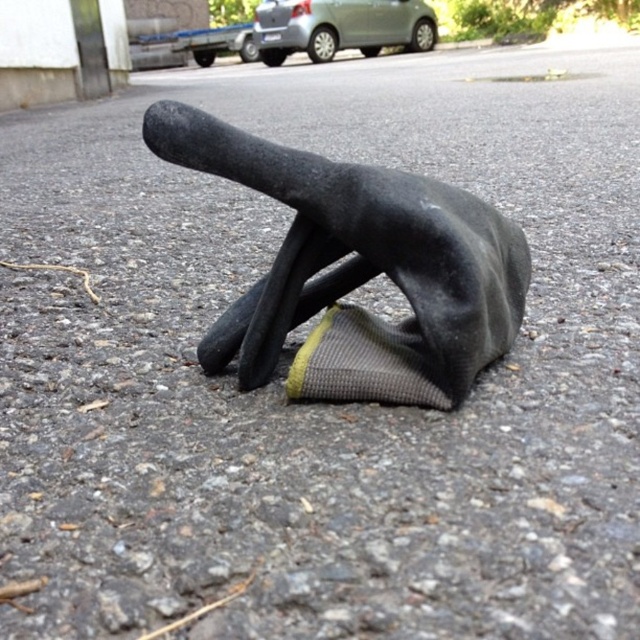
Question: Which point appears closest to the camera in this image?

Choices:
 (A) (362, 16)
 (B) (170, 102)

Answer: (B)

Question: Can you confirm if black rubber glove at center is positioned below satin silver car at upper center?

Choices:
 (A) no
 (B) yes

Answer: (B)

Question: Which point is closer to the camera taking this photo?

Choices:
 (A) (328, 12)
 (B) (342, 381)

Answer: (B)

Question: Considering the relative positions of black rubber glove at center and satin silver car at upper center in the image provided, where is black rubber glove at center located with respect to satin silver car at upper center?

Choices:
 (A) right
 (B) left

Answer: (B)

Question: Is the position of black rubber glove at center more distant than that of satin silver car at upper center?

Choices:
 (A) yes
 (B) no

Answer: (B)